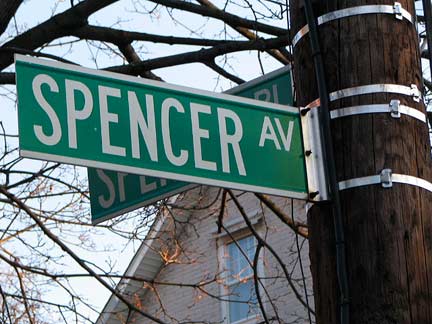
Where is `upper half of window`? The image size is (432, 324). upper half of window is located at coordinates (244, 261).